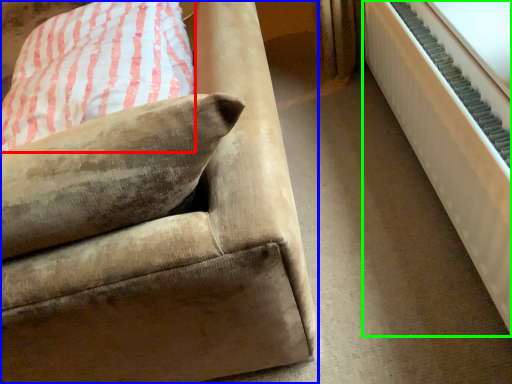
Question: Estimate the real-world distances between objects in this image. Which object is farther from pillow (highlighted by a red box), studio couch (highlighted by a blue box) or radiator (highlighted by a green box)?

Choices:
 (A) studio couch
 (B) radiator

Answer: (B)